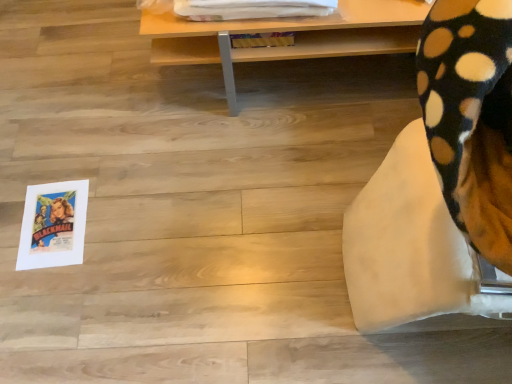
Locate an element on the screen. free space that is to the left of soft fleece blanket at lower right is located at coordinates (269, 274).